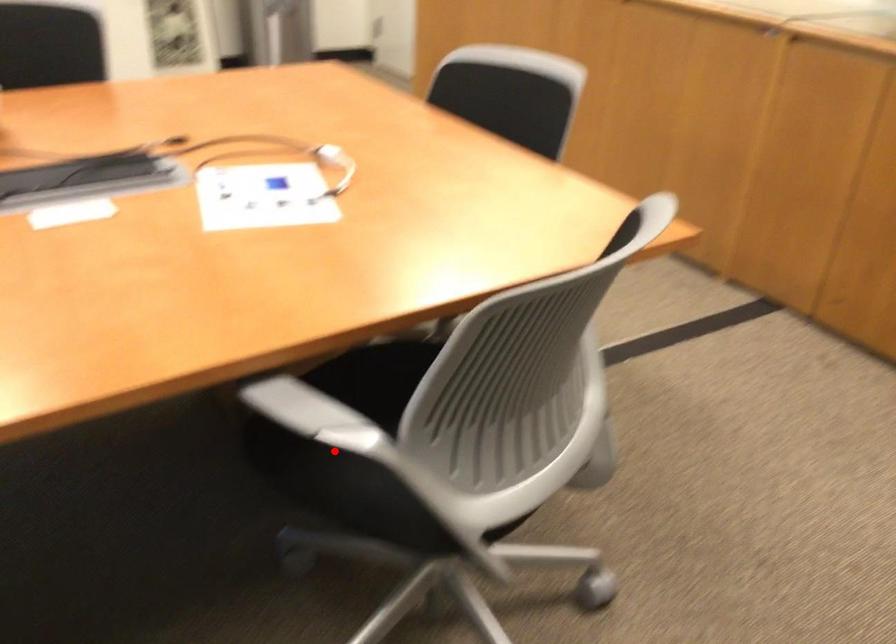
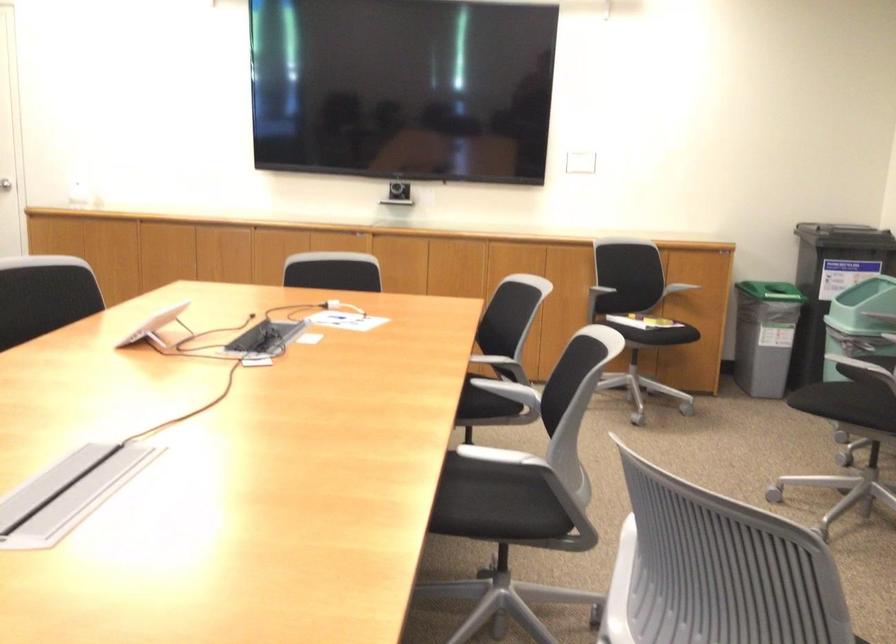
Find the pixel in the second image that matches the highlighted location in the first image.

(505, 366)